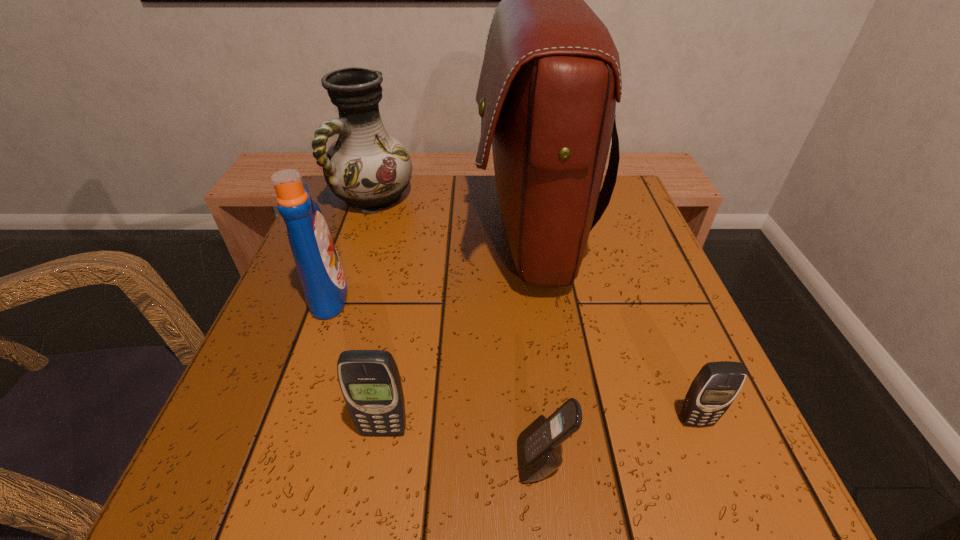
Locate an element on the screen. This screenshot has height=540, width=960. vacant space at the right edge of the desktop is located at coordinates (592, 232).

Find the location of a particular element. free region at the far left corner is located at coordinates (327, 193).

Where is `free space at the near left corner`? free space at the near left corner is located at coordinates (213, 487).

The height and width of the screenshot is (540, 960). Identify the location of free point at the near right corner. (740, 495).

The image size is (960, 540). Identify the location of empty location between the rightmost cellular telephone and the vase. (535, 309).

Locate an element on the screen. Image resolution: width=960 pixels, height=540 pixels. empty space that is in between the second cellular telephone from right to left and the vase is located at coordinates (458, 329).

The width and height of the screenshot is (960, 540). Find the location of `blank region between the rightmost cellular telephone and the nearest object`. blank region between the rightmost cellular telephone and the nearest object is located at coordinates (619, 441).

Locate an element on the screen. free point between the detergent and the tallest object is located at coordinates (429, 264).

At what (x,y) coordinates should I click in order to perform the action: click on free spot between the leftmost cellular telephone and the second cellular telephone from left to right. Please return your answer as a coordinate pair (x, y). Looking at the image, I should click on (464, 446).

This screenshot has width=960, height=540. I want to click on unoccupied area between the tallest object and the detergent, so click(x=429, y=264).